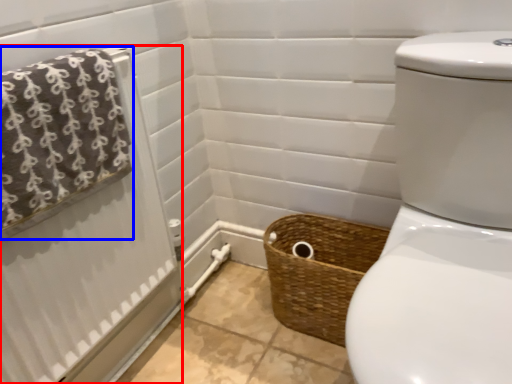
Question: Which object is further to the camera taking this photo, shower curtain (highlighted by a red box) or bath towel (highlighted by a blue box)?

Choices:
 (A) shower curtain
 (B) bath towel

Answer: (A)